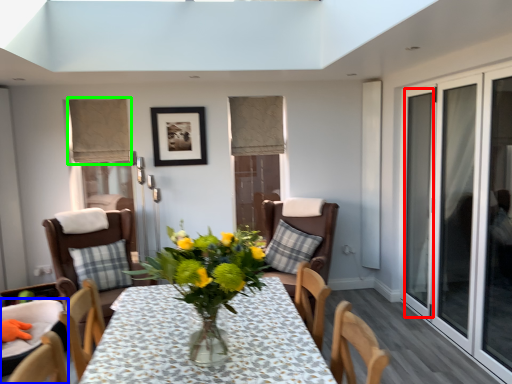
Question: Based on their relative distances, which object is farther from glass door (highlighted by a red box)? Choose from chair (highlighted by a blue box) and curtain (highlighted by a green box).

Choices:
 (A) chair
 (B) curtain

Answer: (A)